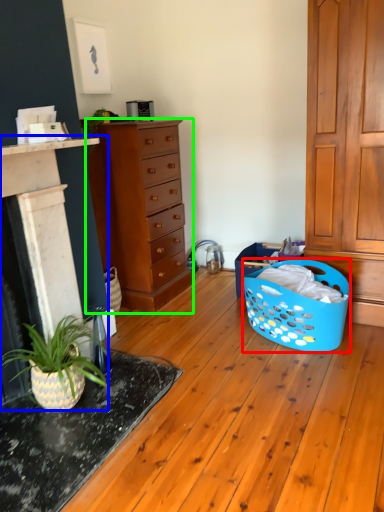
Question: Which object is the closest to the basket (highlighted by a red box)? Choose among these: fireplace (highlighted by a blue box) or chest of drawers (highlighted by a green box).

Choices:
 (A) fireplace
 (B) chest of drawers

Answer: (B)